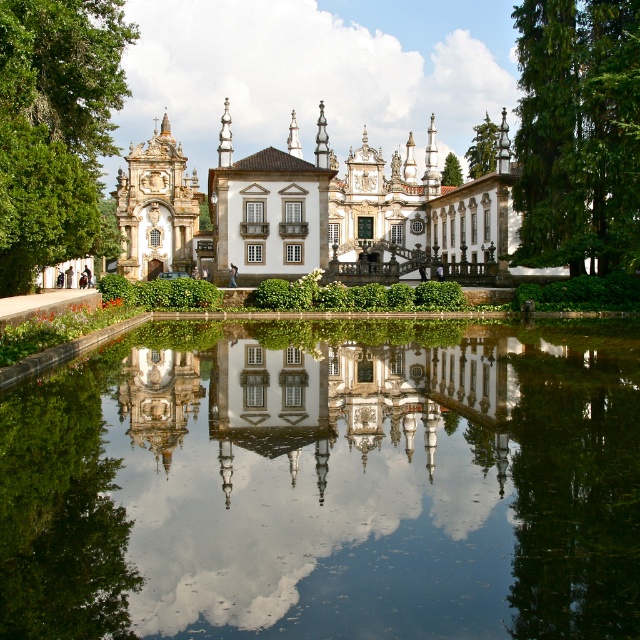
Is clear glass water at center thinner than green leafy tree at upper right?

In fact, clear glass water at center might be wider than green leafy tree at upper right.

Does clear glass water at center appear on the right side of green leafy tree at upper right?

No, clear glass water at center is not to the right of green leafy tree at upper right.

Who is more forward, (250,416) or (614,237)?

Positioned in front is point (250,416).

This screenshot has width=640, height=640. I want to click on clear glass water at center, so click(324, 484).

Between white stone palace at center and green leafy tree at upper center, which one has more height?

Standing taller between the two is white stone palace at center.

The height and width of the screenshot is (640, 640). Describe the element at coordinates (355, 214) in the screenshot. I see `white stone palace at center` at that location.

Is point (456, 211) farther from camera compared to point (476, 164)?

No, it is not.

Where is `white stone palace at center`? This screenshot has width=640, height=640. white stone palace at center is located at coordinates (355, 214).

Is point (196, 588) more distant than point (45, 122)?

No.

Is point (72, 429) more distant than point (35, 173)?

No, it is not.

In order to click on clear glass water at center in this screenshot , I will do `click(324, 484)`.